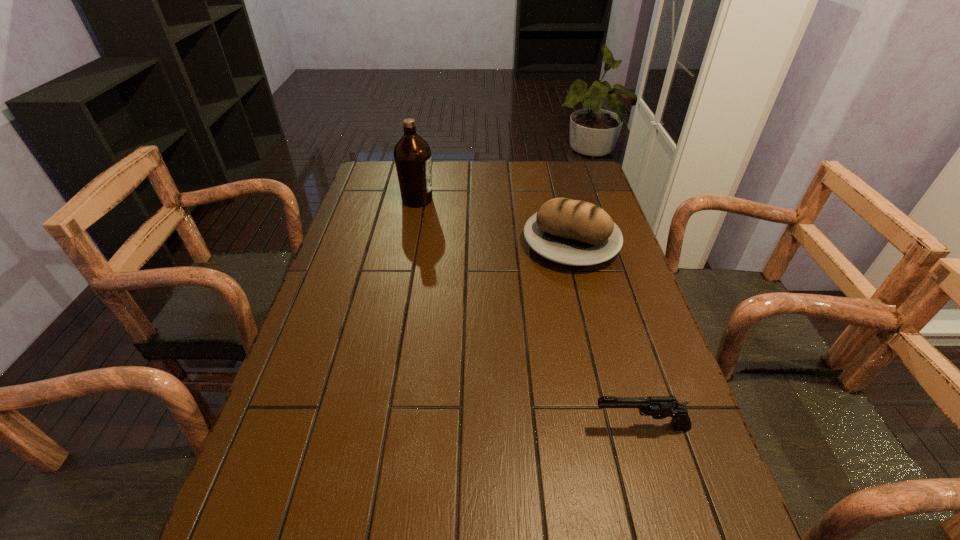
What are the coordinates of `the tallest object` in the screenshot? It's located at (412, 154).

I want to click on the farthest object, so click(412, 154).

The height and width of the screenshot is (540, 960). I want to click on the second farthest object, so click(572, 232).

Identify the location of bread. (572, 232).

This screenshot has width=960, height=540. Find the location of `the nearest object`. the nearest object is located at coordinates (659, 407).

Find the location of a particular element. the shortest object is located at coordinates (659, 407).

The width and height of the screenshot is (960, 540). I want to click on vacant space located on the label of the olive oil, so click(x=486, y=200).

Where is `vacant space located 0.330m on the front of the bread`? vacant space located 0.330m on the front of the bread is located at coordinates (603, 371).

Where is `free space located at the end of the barrel of the gun`? The width and height of the screenshot is (960, 540). free space located at the end of the barrel of the gun is located at coordinates (397, 426).

Locate an element on the screen. This screenshot has width=960, height=540. vacant space located at the end of the barrel of the gun is located at coordinates (553, 426).